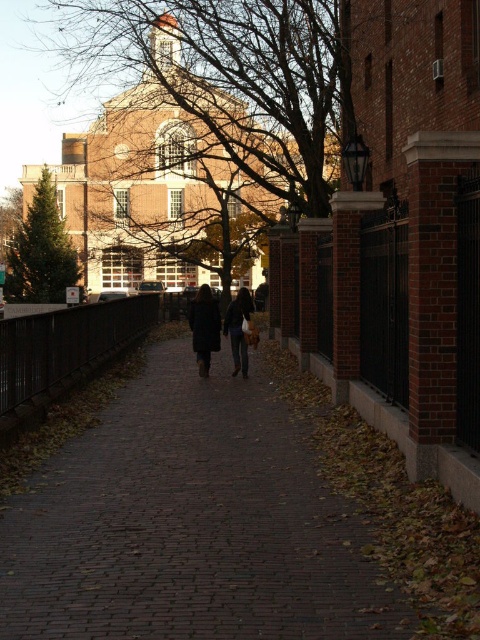
Which of these two, green matte tree at left or dark wool coat at center, stands taller?

With more height is green matte tree at left.

Is point (55, 227) closer to viewer compared to point (201, 321)?

No.

Locate an element on the screen. green matte tree at left is located at coordinates (41, 252).

You are a GUI agent. You are given a task and a screenshot of the screen. Output one action in this format:
    pyautogui.click(x=<x>, y=<y>)
    Task: Click on the green matte tree at left
    This screenshot has height=640, width=480.
    Given the screenshot: What is the action you would take?
    pyautogui.click(x=41, y=252)

Who is shorter, brick pavement at center or green matte tree at left?

brick pavement at center

Is brick pavement at center behind green matte tree at left?

No.

Is point (267, 534) in front of point (48, 280)?

That is True.

Identify the location of brick pavement at center. The width and height of the screenshot is (480, 640). (192, 524).

Does dark brown leather coat at center appear over dark wool coat at center?

Yes.

Can you confirm if dark brown leather coat at center is positioned to the left of dark wool coat at center?

Incorrect, dark brown leather coat at center is not on the left side of dark wool coat at center.

The image size is (480, 640). I want to click on dark brown leather coat at center, so click(x=238, y=330).